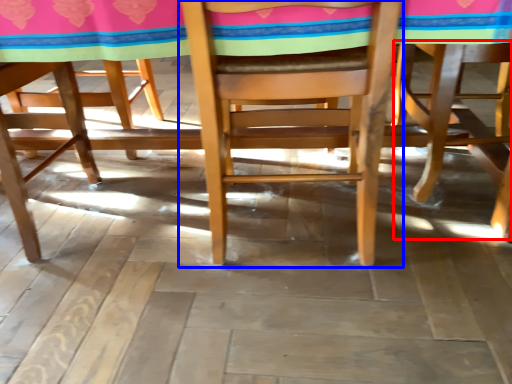
Question: Which object is further to the camera taking this photo, chair (highlighted by a red box) or chair (highlighted by a blue box)?

Choices:
 (A) chair
 (B) chair

Answer: (A)